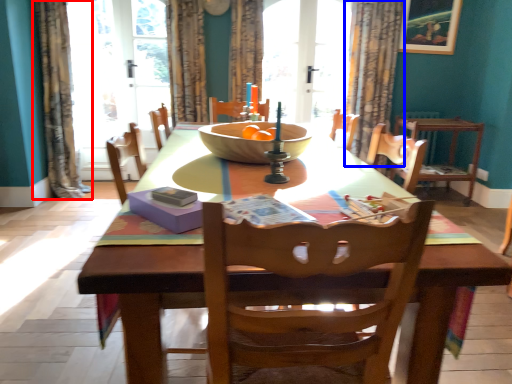
Question: Which point is further to the camera, curtain (highlighted by a red box) or curtain (highlighted by a blue box)?

Choices:
 (A) curtain
 (B) curtain

Answer: (B)